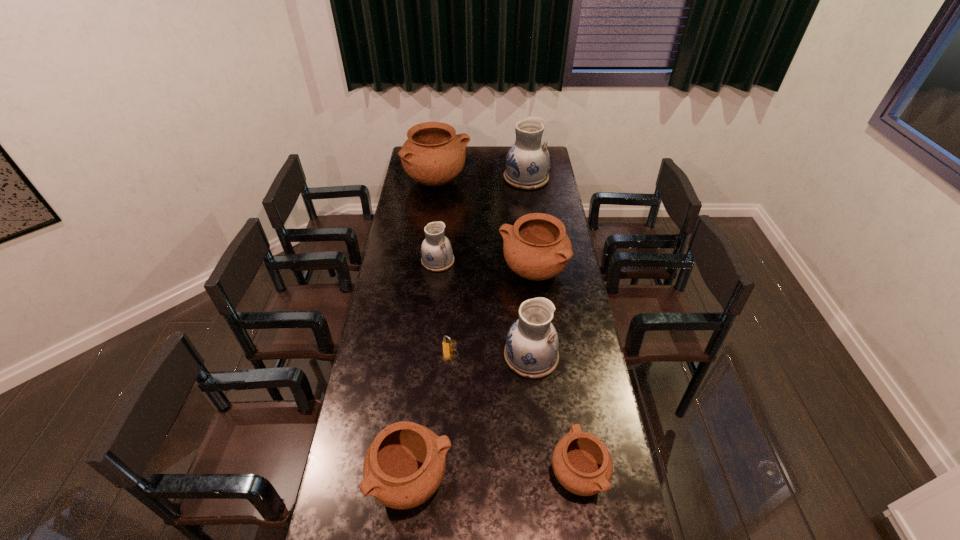
Find the location of a particular element. The width and height of the screenshot is (960, 540). free spot between the second farthest terracotta pottery and the shortest pottery is located at coordinates (555, 372).

The image size is (960, 540). What are the coordinates of `object that is the sixth nearest to the biggest terracotta pottery` in the screenshot? It's located at (404, 466).

Identify which object is the nearest to the leftmost blue pottery. Please provide its 2D coordinates. Your answer should be formatted as a tuple, i.e. [(x, y)], where the tuple contains the x and y coordinates of a point satisfying the conditions above.

[(536, 247)]

This screenshot has width=960, height=540. In order to click on the sixth closest pottery relative to the second shortest object in this screenshot , I will do `click(527, 163)`.

Locate an element on the screen. the fifth closest pottery relative to the second farthest terracotta pottery is located at coordinates (582, 464).

Identify the location of the third closest blue pottery to the farthest terracotta pottery. (531, 350).

Locate which blue pottery ranks third in proximity to the padlock. Please provide its 2D coordinates. Your answer should be formatted as a tuple, i.e. [(x, y)], where the tuple contains the x and y coordinates of a point satisfying the conditions above.

[(527, 163)]

I want to click on terracotta pottery that is the second nearest to the nearest blue pottery, so coord(582,464).

Point out which terracotta pottery is positioned as the fourth nearest to the padlock. Please provide its 2D coordinates. Your answer should be formatted as a tuple, i.e. [(x, y)], where the tuple contains the x and y coordinates of a point satisfying the conditions above.

[(433, 155)]

At what (x,y) coordinates should I click in order to perform the action: click on vacant space that satisfies the following two spatial constraints: 1. on the front side of the farthest terracotta pottery; 2. on the left side of the second biggest terracotta pottery. Please return your answer as a coordinate pair (x, y). Looking at the image, I should click on (426, 271).